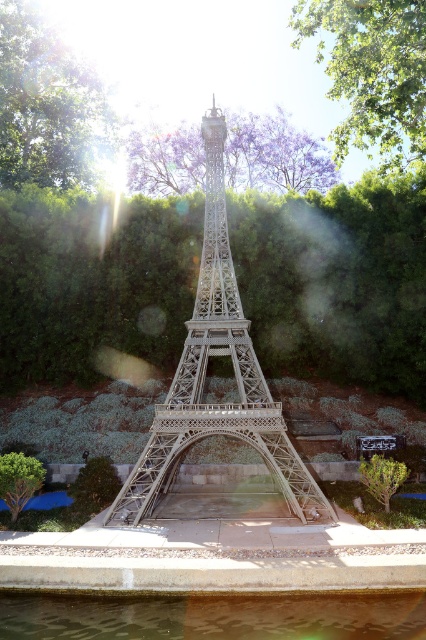
You are standing in front of the Eiffel Tower model surrounded by greenery. You notice two points marked in the scene. Which point, point (144, 467) or point (308, 10), is closer to you?

Point (144, 467) is closer to the viewer than point (308, 10).

You are a photographer planning to capture a wide shot of the metallic silver eiffel tower at center and the green leafy tree at upper center. Based on their sizes in the image, which object will appear taller in the final photograph?

The metallic silver eiffel tower at center will appear taller in the final photograph because it has a greater height compared to the green leafy tree at upper center.

You are standing at the base of the Eiffel Tower model in the image. Looking around, you notice a point marked at coordinates [336,280]. What object is located at this point?

The point at coordinates [336,280] corresponds to the green leafy hedge at center.